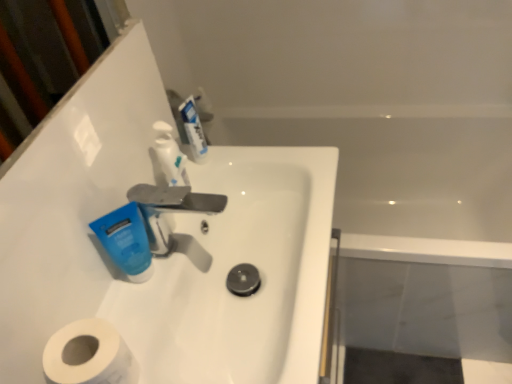
The image size is (512, 384). What do you see at coordinates (126, 241) in the screenshot?
I see `blue matte tube at center-left, the first mouthwash positioned from the bottom` at bounding box center [126, 241].

What do you see at coordinates (403, 175) in the screenshot? The width and height of the screenshot is (512, 384). I see `white glossy bathtub at upper right` at bounding box center [403, 175].

The width and height of the screenshot is (512, 384). What do you see at coordinates (193, 129) in the screenshot?
I see `white glossy mouthwash at upper center, acting as the first mouthwash starting from the right` at bounding box center [193, 129].

Locate an element on the screen. The height and width of the screenshot is (384, 512). silver metallic faucet at center is located at coordinates (170, 209).

The height and width of the screenshot is (384, 512). What do you see at coordinates (170, 209) in the screenshot? I see `silver metallic faucet at center` at bounding box center [170, 209].

At what (x,y) coordinates should I click in order to perform the action: click on white glossy sink at center. Please return your answer as a coordinate pair (x, y). This screenshot has width=512, height=384. Looking at the image, I should click on (233, 266).

Locate an element on the screen. This screenshot has width=512, height=384. blue matte tube at center-left, the first mouthwash positioned from the bottom is located at coordinates (126, 241).

Between point (134, 243) and point (115, 360), which one is positioned in front?

Positioned in front is point (115, 360).

Is blue matte tube at center-left, the second mouthwash from the right, completely or partially outside of white matte toilet paper at lower left?

Absolutely, blue matte tube at center-left, the second mouthwash from the right, is external to white matte toilet paper at lower left.

Considering the positions of objects blue matte tube at center-left, the first mouthwash positioned from the bottom, and white matte toilet paper at lower left in the image provided, who is more to the left, blue matte tube at center-left, the first mouthwash positioned from the bottom, or white matte toilet paper at lower left?

From the viewer's perspective, white matte toilet paper at lower left appears more on the left side.

Considering the relative sizes of blue matte tube at center-left, marked as the first mouthwash in a left-to-right arrangement, and white matte toilet paper at lower left in the image provided, is blue matte tube at center-left, marked as the first mouthwash in a left-to-right arrangement, taller than white matte toilet paper at lower left?

No, blue matte tube at center-left, marked as the first mouthwash in a left-to-right arrangement, is not taller than white matte toilet paper at lower left.

Does white glossy sink at center lie in front of white matte toilet paper at lower left?

No, white glossy sink at center is further to the viewer.

Would you say white glossy sink at center is inside or outside white matte toilet paper at lower left?

white glossy sink at center is located beyond the bounds of white matte toilet paper at lower left.

Is white glossy sink at center to the right of white matte toilet paper at lower left from the viewer's perspective?

Yes, white glossy sink at center is to the right of white matte toilet paper at lower left.

Is white glossy sink at center directly adjacent to white matte toilet paper at lower left?

No, white glossy sink at center is not beside white matte toilet paper at lower left.

Considering the points (164, 170) and (198, 196), which point is in front, point (164, 170) or point (198, 196)?

The point (198, 196) is closer.

Does white glossy soap dispenser at upper center contain silver metallic faucet at center?

Actually, silver metallic faucet at center is outside white glossy soap dispenser at upper center.

Is white glossy soap dispenser at upper center looking in the opposite direction of silver metallic faucet at center?

No, white glossy soap dispenser at upper center's orientation is not away from silver metallic faucet at center.

Does white glossy soap dispenser at upper center have a greater width compared to silver metallic faucet at center?

In fact, white glossy soap dispenser at upper center might be narrower than silver metallic faucet at center.

Which object is thinner, blue matte tube at center-left, arranged as the 2th mouthwash when viewed from the top, or silver metallic faucet at center?

blue matte tube at center-left, arranged as the 2th mouthwash when viewed from the top, is thinner.

Is blue matte tube at center-left, arranged as the 2th mouthwash when viewed from the top, oriented towards silver metallic faucet at center?

No, blue matte tube at center-left, arranged as the 2th mouthwash when viewed from the top, is not oriented towards silver metallic faucet at center.

Is the depth of blue matte tube at center-left, arranged as the 2th mouthwash when viewed from the top, greater than that of silver metallic faucet at center?

No, it is not.

Is blue matte tube at center-left, the first mouthwash positioned from the bottom, to the left of white glossy soap dispenser at upper center from the viewer's perspective?

Indeed, blue matte tube at center-left, the first mouthwash positioned from the bottom, is positioned on the left side of white glossy soap dispenser at upper center.

Is point (125, 210) positioned before point (172, 149)?

Yes, it is in front of point (172, 149).

How many degrees apart are the facing directions of blue matte tube at center-left, placed as the first mouthwash when sorted from front to back, and white glossy soap dispenser at upper center?

39.5 degrees separate the facing orientations of blue matte tube at center-left, placed as the first mouthwash when sorted from front to back, and white glossy soap dispenser at upper center.

Looking at the image, does blue matte tube at center-left, placed as the first mouthwash when sorted from front to back, seem bigger or smaller compared to white glossy soap dispenser at upper center?

In the image, blue matte tube at center-left, placed as the first mouthwash when sorted from front to back, appears to be larger than white glossy soap dispenser at upper center.

Are silver metallic faucet at center and blue matte tube at center-left, the second mouthwash viewed from the back, located far from each other?

Actually, silver metallic faucet at center and blue matte tube at center-left, the second mouthwash viewed from the back, are a little close together.

In the scene shown: In the image, is silver metallic faucet at center positioned in front of or behind blue matte tube at center-left, the second mouthwash viewed from the back?

silver metallic faucet at center is behind blue matte tube at center-left, the second mouthwash viewed from the back.

Does silver metallic faucet at center have a lesser height compared to blue matte tube at center-left, marked as the first mouthwash in a left-to-right arrangement?

No, silver metallic faucet at center is not shorter than blue matte tube at center-left, marked as the first mouthwash in a left-to-right arrangement.

Considering the sizes of silver metallic faucet at center and blue matte tube at center-left, marked as the first mouthwash in a left-to-right arrangement, in the image, is silver metallic faucet at center bigger or smaller than blue matte tube at center-left, marked as the first mouthwash in a left-to-right arrangement,?

In the image, silver metallic faucet at center appears to be larger than blue matte tube at center-left, marked as the first mouthwash in a left-to-right arrangement.

Which is in front, point (117, 228) or point (209, 284)?

Positioned in front is point (117, 228).

Where is `the 1st mouthwash behind when counting from the white glossy sink at center`? the 1st mouthwash behind when counting from the white glossy sink at center is located at coordinates coord(126,241).

Does blue matte tube at center-left, placed as the first mouthwash when sorted from front to back, touch white glossy sink at center?

There is a gap between blue matte tube at center-left, placed as the first mouthwash when sorted from front to back, and white glossy sink at center.

Image resolution: width=512 pixels, height=384 pixels. What are the coordinates of `toilet paper in front of the blue matte tube at center-left, the second mouthwash from the right` in the screenshot? It's located at (89, 355).

You are a GUI agent. You are given a task and a screenshot of the screen. Output one action in this format:
    pyautogui.click(x=<x>, y=<y>)
    Task: Click on the toilet paper located below the white glossy sink at center (from the image's perspective)
    The width and height of the screenshot is (512, 384).
    Given the screenshot: What is the action you would take?
    pyautogui.click(x=89, y=355)

Based on their spatial positions, is white glossy soap dispenser at upper center or blue matte tube at center-left, the first mouthwash positioned from the bottom, closer to white glossy sink at center?

Based on the image, blue matte tube at center-left, the first mouthwash positioned from the bottom, appears to be nearer to white glossy sink at center.

Based on their spatial positions, is white glossy bathtub at upper right or silver metallic faucet at center further from white matte toilet paper at lower left?

white glossy bathtub at upper right.

Looking at the image, which one is located closer to white glossy bathtub at upper right, white matte toilet paper at lower left or white glossy soap dispenser at upper center?

The object closer to white glossy bathtub at upper right is white glossy soap dispenser at upper center.

Looking at the image, which one is located closer to silver metallic faucet at center, white glossy bathtub at upper right or white glossy sink at center?

white glossy sink at center lies closer to silver metallic faucet at center than the other object.

Estimate the real-world distances between objects in this image. Which object is further from white glossy bathtub at upper right, blue matte tube at center-left, placed as the first mouthwash when sorted from front to back, or white glossy mouthwash at upper center, which is counted as the second mouthwash, starting from the left?

Among the two, blue matte tube at center-left, placed as the first mouthwash when sorted from front to back, is located further to white glossy bathtub at upper right.

From the image, which object appears to be farther from white glossy mouthwash at upper center, the second mouthwash in the front-to-back sequence, white glossy soap dispenser at upper center or white glossy bathtub at upper right?

white glossy bathtub at upper right is further to white glossy mouthwash at upper center, the second mouthwash in the front-to-back sequence.

From the image, which object appears to be farther from white glossy soap dispenser at upper center, silver metallic faucet at center or white glossy mouthwash at upper center, which is counted as the second mouthwash, starting from the left?

silver metallic faucet at center lies further to white glossy soap dispenser at upper center than the other object.

Looking at the image, which one is located closer to white glossy mouthwash at upper center, which is counted as the second mouthwash, starting from the left, blue matte tube at center-left, marked as the first mouthwash in a left-to-right arrangement, or white glossy soap dispenser at upper center?

The object closer to white glossy mouthwash at upper center, which is counted as the second mouthwash, starting from the left, is white glossy soap dispenser at upper center.

Find the location of a particular element. sink between white glossy soap dispenser at upper center and white matte toilet paper at lower left vertically is located at coordinates 233,266.

Where is `mouthwash between white glossy mouthwash at upper center, the 2th mouthwash in the bottom-to-top sequence, and white matte toilet paper at lower left in the up-down direction`? The height and width of the screenshot is (384, 512). mouthwash between white glossy mouthwash at upper center, the 2th mouthwash in the bottom-to-top sequence, and white matte toilet paper at lower left in the up-down direction is located at coordinates (126, 241).

You are a GUI agent. You are given a task and a screenshot of the screen. Output one action in this format:
    pyautogui.click(x=<x>, y=<y>)
    Task: Click on the tap between white glossy sink at center and white glossy mouthwash at upper center, which is counted as the second mouthwash, starting from the left, from front to back
    Image resolution: width=512 pixels, height=384 pixels.
    Given the screenshot: What is the action you would take?
    pyautogui.click(x=170, y=209)

Where is `mouthwash positioned between white glossy sink at center and white glossy mouthwash at upper center, the second mouthwash in the front-to-back sequence, from near to far`? mouthwash positioned between white glossy sink at center and white glossy mouthwash at upper center, the second mouthwash in the front-to-back sequence, from near to far is located at coordinates (126, 241).